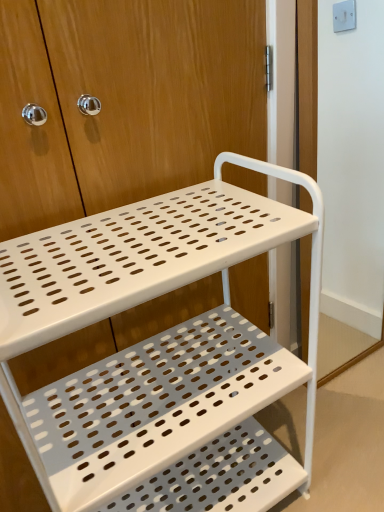
Question: From a real-world perspective, relative to white matte screen door at right, is white perforated metal cart at center vertically above or below?

Choices:
 (A) above
 (B) below

Answer: (B)

Question: Does point (19, 301) appear closer or farther from the camera than point (304, 357)?

Choices:
 (A) closer
 (B) farther

Answer: (A)

Question: Is white perforated metal cart at center wider or thinner than white matte screen door at right?

Choices:
 (A) thin
 (B) wide

Answer: (B)

Question: From the image's perspective, is white matte screen door at right above or below white perforated metal cart at center?

Choices:
 (A) above
 (B) below

Answer: (A)

Question: Is white matte screen door at right taller or shorter than white perforated metal cart at center?

Choices:
 (A) tall
 (B) short

Answer: (A)

Question: Considering the relative positions of white matte screen door at right and white perforated metal cart at center in the image provided, is white matte screen door at right to the left or to the right of white perforated metal cart at center?

Choices:
 (A) left
 (B) right

Answer: (B)

Question: Is point (316, 147) positioned closer to the camera than point (132, 211)?

Choices:
 (A) closer
 (B) farther

Answer: (B)